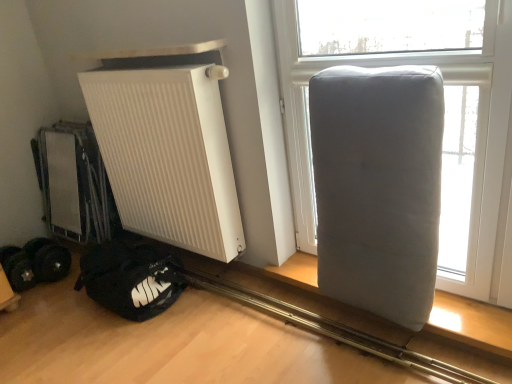
Question: Does gray fabric cushion at right lie in front of gray fabric mattress at right?

Choices:
 (A) no
 (B) yes

Answer: (B)

Question: From the image's perspective, is gray fabric cushion at right located beneath gray fabric mattress at right?

Choices:
 (A) no
 (B) yes

Answer: (A)

Question: Does gray fabric cushion at right appear on the right side of gray fabric mattress at right?

Choices:
 (A) yes
 (B) no

Answer: (A)

Question: Is gray fabric cushion at right not close to gray fabric mattress at right?

Choices:
 (A) no
 (B) yes

Answer: (A)

Question: Is gray fabric cushion at right thinner than gray fabric mattress at right?

Choices:
 (A) yes
 (B) no

Answer: (A)

Question: From the image's perspective, is black rubber weights at lower left located above or below black fabric sleeping bag at lower left?

Choices:
 (A) below
 (B) above

Answer: (B)

Question: Would you say black rubber weights at lower left is to the left or to the right of black fabric sleeping bag at lower left in the picture?

Choices:
 (A) left
 (B) right

Answer: (A)

Question: Based on their sizes in the image, would you say black rubber weights at lower left is bigger or smaller than black fabric sleeping bag at lower left?

Choices:
 (A) big
 (B) small

Answer: (B)

Question: Is black rubber weights at lower left wider or thinner than black fabric sleeping bag at lower left?

Choices:
 (A) thin
 (B) wide

Answer: (A)

Question: Looking at the image, does white matte radiator at left seem bigger or smaller compared to gray fabric mattress at right?

Choices:
 (A) big
 (B) small

Answer: (A)

Question: From a real-world perspective, is white matte radiator at left above or below gray fabric mattress at right?

Choices:
 (A) below
 (B) above

Answer: (B)

Question: Considering the positions of white matte radiator at left and gray fabric mattress at right in the image, is white matte radiator at left wider or thinner than gray fabric mattress at right?

Choices:
 (A) wide
 (B) thin

Answer: (B)

Question: Considering the positions of point (104, 155) and point (333, 69), is point (104, 155) closer or farther from the camera than point (333, 69)?

Choices:
 (A) farther
 (B) closer

Answer: (A)

Question: From the image's perspective, relative to gray fabric cushion at right, is black fabric sleeping bag at lower left above or below?

Choices:
 (A) below
 (B) above

Answer: (A)

Question: Is black fabric sleeping bag at lower left wider or thinner than gray fabric cushion at right?

Choices:
 (A) thin
 (B) wide

Answer: (B)